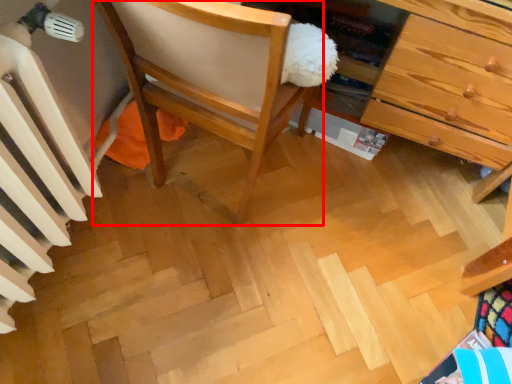
Question: From the image's perspective, considering the relative positions of chair (annotated by the red box) and radiator in the image provided, where is chair (annotated by the red box) located with respect to the staircase?

Choices:
 (A) above
 (B) below

Answer: (A)